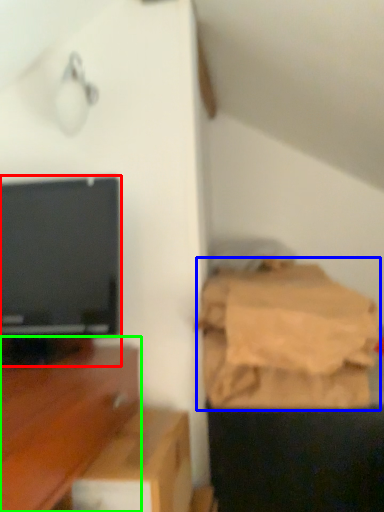
Question: Estimate the real-world distances between objects in this image. Which object is closer to television (highlighted by a red box), sheet (highlighted by a blue box) or furniture (highlighted by a green box)?

Choices:
 (A) sheet
 (B) furniture

Answer: (B)